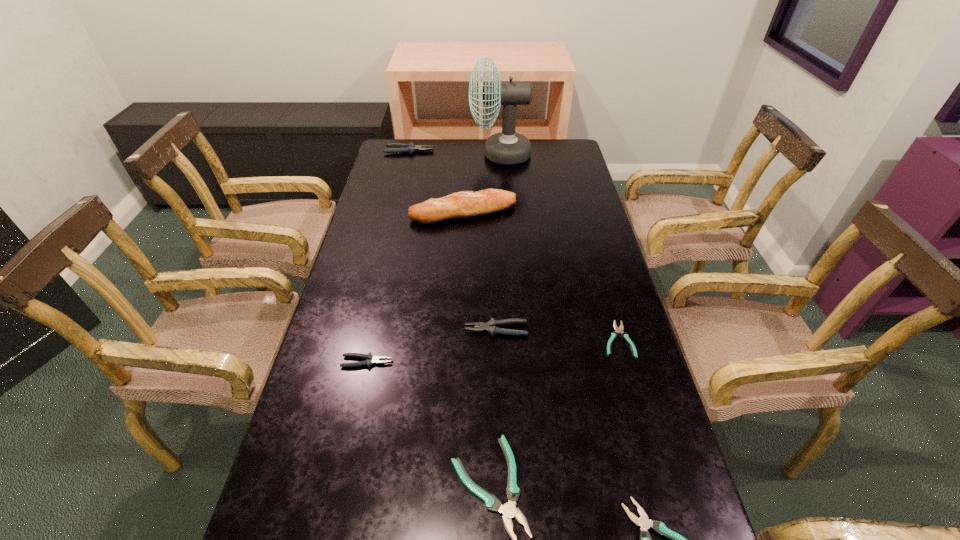
The width and height of the screenshot is (960, 540). In order to click on fan positioned at the far edge in this screenshot , I will do `click(507, 147)`.

This screenshot has height=540, width=960. What are the coordinates of `pliers that is positioned at the far edge` in the screenshot? It's located at (396, 147).

Identify the location of baguet positioned at the left edge. The width and height of the screenshot is (960, 540). (464, 204).

Identify the location of object present at the right edge. (614, 334).

Identify the location of object present at the far left corner. The width and height of the screenshot is (960, 540). (396, 147).

In the image, there is a desktop. At what (x,y) coordinates should I click in order to perform the action: click on free space at the far edge. Please return your answer as a coordinate pair (x, y). Looking at the image, I should click on (423, 163).

In the image, there is a desktop. Identify the location of vacant space at the left edge. (415, 177).

Where is `vacant position at the right edge of the desktop`? The width and height of the screenshot is (960, 540). vacant position at the right edge of the desktop is located at coordinates (578, 360).

Where is `vacant space at the far left corner of the desktop`? vacant space at the far left corner of the desktop is located at coordinates (407, 160).

In the image, there is a desktop. Where is `vacant space at the far right corner`? The image size is (960, 540). vacant space at the far right corner is located at coordinates (543, 164).